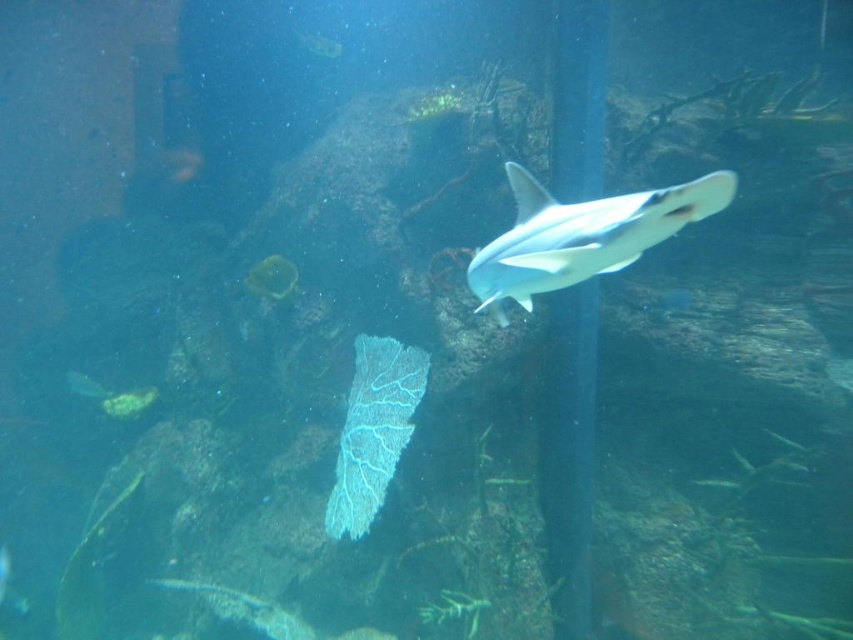
You are an underwater photographer aiming to capture both the white smooth shark at center and the translucent white shark at center in a single shot. Based on their positions, which shark should you adjust your camera focus to first to ensure both are in the frame?

The white smooth shark at center is to the right of the translucent white shark at center, so you should focus on the translucent white shark at center first to ensure both are within the frame.

You are a diver who wants to place a marker at the closest point to you in the underwater scene. Which of the two points, point (520,268) or point (706,481), should you choose?

Point (520,268) is closer to the viewer than point (706,481), so you should choose point (520,268).

You are an underwater photographer aiming to capture a clear image of both the white smooth shark at center and the white matte shark at center. Which shark will appear more reflective in the photo?

The white smooth shark at center will appear more reflective in the photo because it is positioned over the white matte shark at center, which has a less reflective surface.